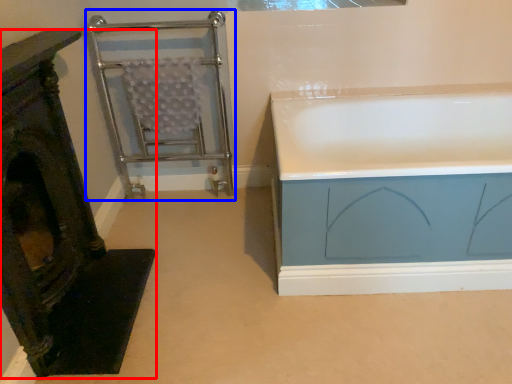
Question: Which of the following is the farthest to the observer, furniture (highlighted by a red box) or cage (highlighted by a blue box)?

Choices:
 (A) furniture
 (B) cage

Answer: (B)